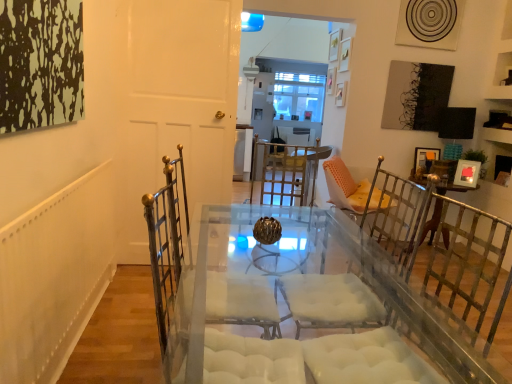
Question: Considering the positions of white matte door at center and wooden picture frame at right in the image, is white matte door at center wider or thinner than wooden picture frame at right?

Choices:
 (A) wide
 (B) thin

Answer: (A)

Question: Is white matte door at center in front of or behind wooden picture frame at right in the image?

Choices:
 (A) behind
 (B) front

Answer: (B)

Question: From the image's perspective, is white matte door at center above or below wooden picture frame at right?

Choices:
 (A) above
 (B) below

Answer: (A)

Question: In terms of width, does wooden picture frame at right look wider or thinner when compared to white matte door at center?

Choices:
 (A) thin
 (B) wide

Answer: (A)

Question: Does point (425, 158) appear closer or farther from the camera than point (181, 134)?

Choices:
 (A) farther
 (B) closer

Answer: (A)

Question: Is wooden picture frame at right inside or outside of white matte door at center?

Choices:
 (A) inside
 (B) outside

Answer: (B)

Question: Is wooden picture frame at right taller or shorter than white matte door at center?

Choices:
 (A) tall
 (B) short

Answer: (B)